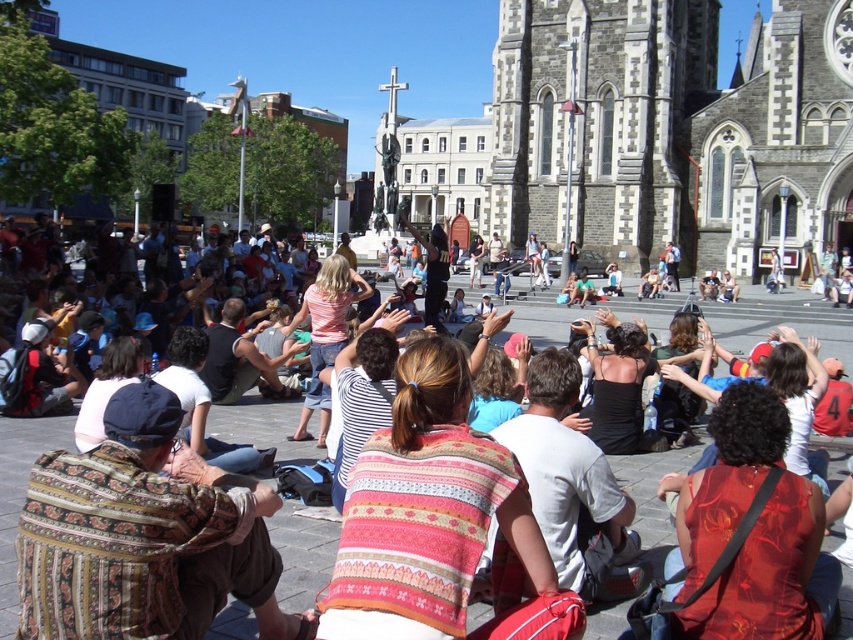
Looking at this image, where is the floral silk dress at center located in the image?

The floral silk dress at center is located at point (752, 532) in the image.

You are a photographer standing in the public square and want to take a photo of both the striped fabric shirt at center and the black satin dress at center. Which one should you focus on first to ensure both are in sharp focus?

You should focus on the striped fabric shirt at center first because it is closer to the viewer than the black satin dress at center, so adjusting focus from near to far will help both be in sharp focus.

You are standing in the public square and want to reach the point marked at coordinates point (724,595). How far will you have to walk to get there?

The point (724,595) is 48.70 meters away from the viewer, so you will have to walk 48.70 meters to reach it.